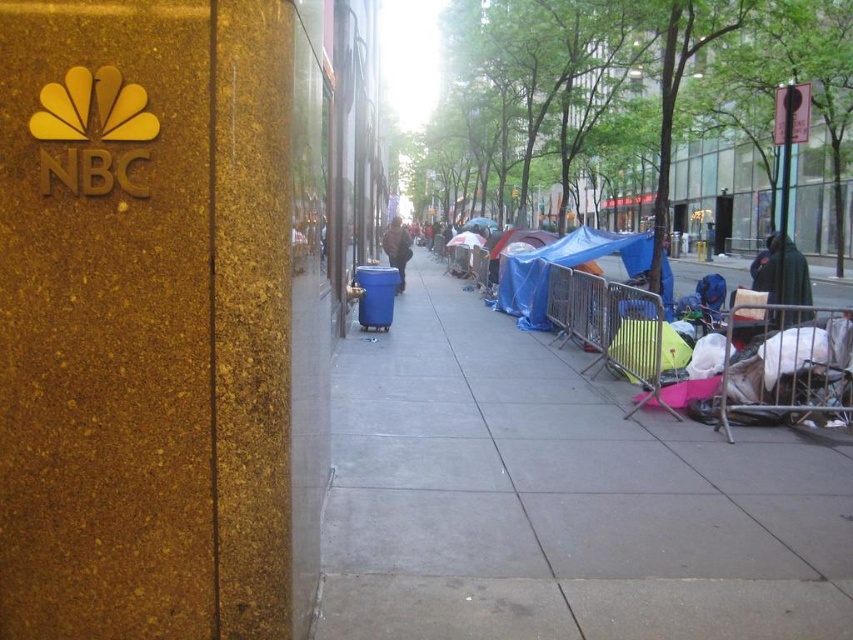
Describe the element at coordinates (781, 273) in the screenshot. I see `dark green cloak at right` at that location.

Which of these two, dark green cloak at right or dark blue fabric at center, stands shorter?

dark blue fabric at center is shorter.

Between point (795, 296) and point (766, 250), which one is positioned in front?

Point (795, 296) is in front.

Locate an element on the screen. dark green cloak at right is located at coordinates (781, 273).

Is point (730, 317) closer to viewer compared to point (397, 252)?

Yes, point (730, 317) is closer to viewer.

From the picture: Who is taller, white fabric baby carriage at lower right or brown fuzzy coat at center?

Result: Standing taller between the two is white fabric baby carriage at lower right.

Who is more forward, (833, 387) or (392, 225)?

Point (833, 387) is more forward.

You are a GUI agent. You are given a task and a screenshot of the screen. Output one action in this format:
    pyautogui.click(x=<x>, y=<y>)
    Task: Click on the white fabric baby carriage at lower right
    
    Given the screenshot: What is the action you would take?
    pyautogui.click(x=788, y=365)

Can you confirm if brown fuzzy coat at center is shorter than dark blue fabric at center?

Indeed, brown fuzzy coat at center has a lesser height compared to dark blue fabric at center.

Is brown fuzzy coat at center positioned behind dark blue fabric at center?

Yes, it is behind dark blue fabric at center.

Does point (401, 244) come behind point (769, 250)?

Yes, it is.

Locate an element on the screen. The height and width of the screenshot is (640, 853). brown fuzzy coat at center is located at coordinates (397, 248).